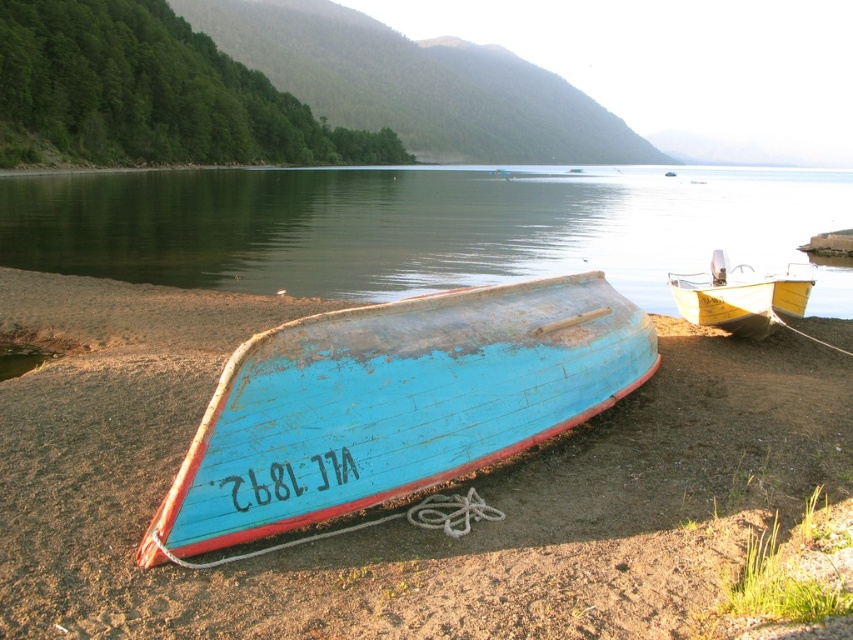
You are standing on the lakeside shore and want to board the yellow wooden boat at center. Which direction should you move relative to the blue wooden boat at center?

You should move to the right of the blue wooden boat at center to reach the yellow wooden boat at center because the blue wooden boat at center is located to the left of the yellow wooden boat at center.

You are standing on the sandy shore looking towards the lake. There are two blue wooden boats in view. Which boat is closer to the mountains, the blue wooden boat at lower center or the blue wooden boat at center?

The blue wooden boat at center is closer to the mountains because the blue wooden boat at lower center is located above it, meaning it is positioned closer to the observer on the shore.